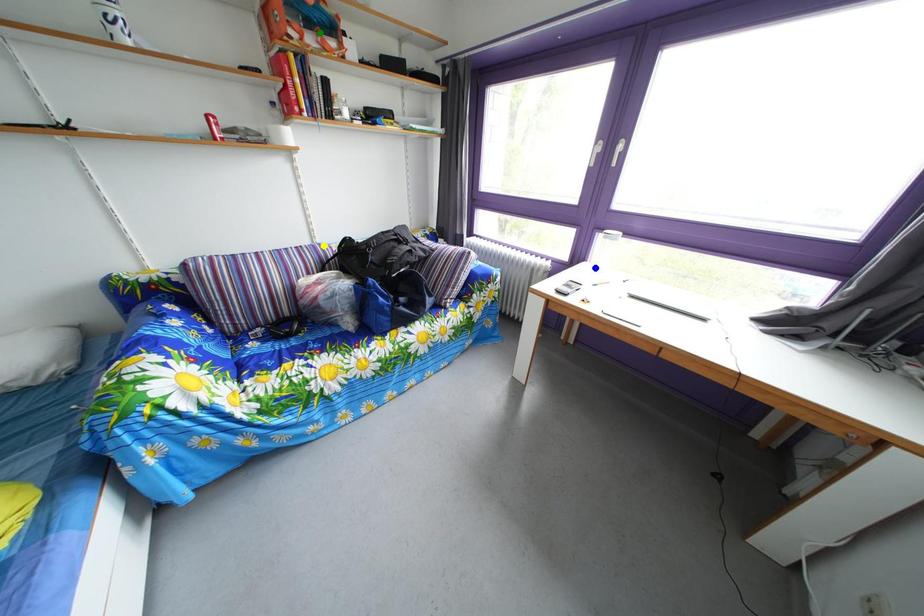
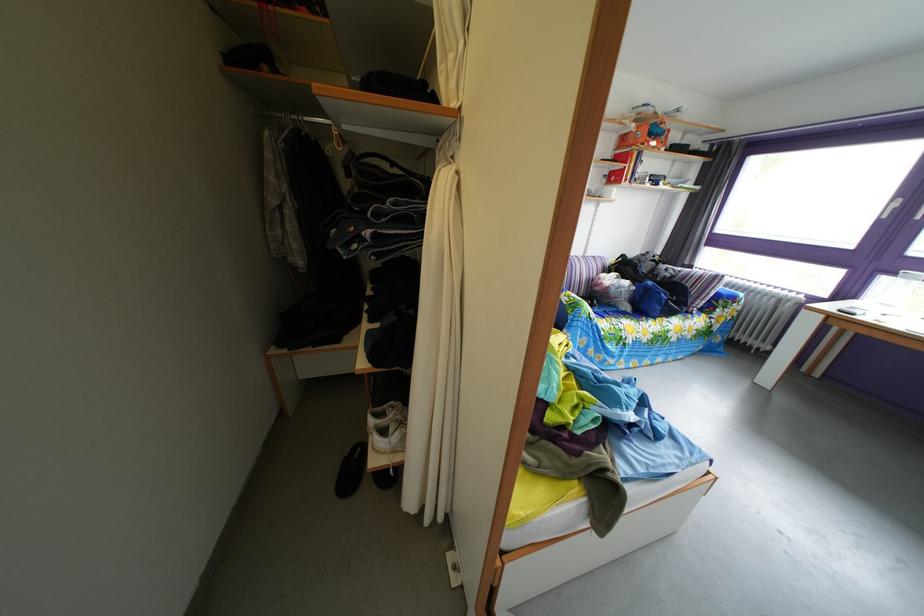
I am providing you with two images of the same scene from different viewpoints. Three points are marked in image1. Which point corresponds to a part or object that is occluded in image2?In image1, three points are marked. Which of them correspond to a part or object that is occluded in image2?Among the three points shown in image1, which one corresponds to a part or object that is no longer visible due to occlusion in image2?

Invisible in image2: blue point.